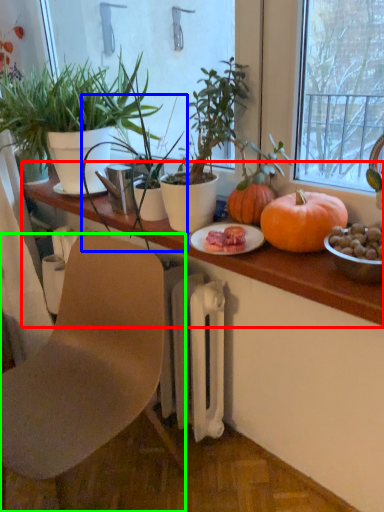
Question: Which object is positioned closest to table (highlighted by a red box)? Select from houseplant (highlighted by a blue box) and chair (highlighted by a green box).

Choices:
 (A) houseplant
 (B) chair

Answer: (A)